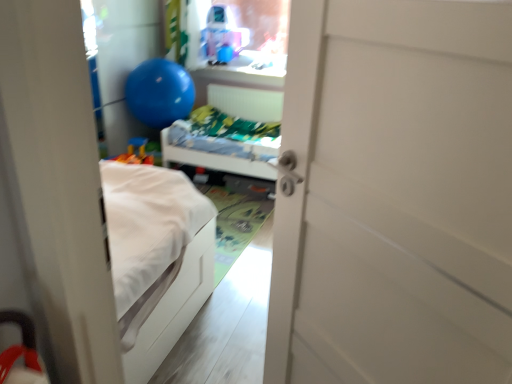
Question: Is blue rubber balloon at upper left positioned before translucent plastic toy at upper center?

Choices:
 (A) no
 (B) yes

Answer: (B)

Question: Is blue rubber balloon at upper left positioned beyond the bounds of translucent plastic toy at upper center?

Choices:
 (A) no
 (B) yes

Answer: (B)

Question: From the image's perspective, is blue rubber balloon at upper left located above translucent plastic toy at upper center?

Choices:
 (A) yes
 (B) no

Answer: (B)

Question: From a real-world perspective, does blue rubber balloon at upper left stand above translucent plastic toy at upper center?

Choices:
 (A) no
 (B) yes

Answer: (A)

Question: Is blue rubber balloon at upper left far from translucent plastic toy at upper center?

Choices:
 (A) no
 (B) yes

Answer: (A)

Question: Looking at the image, does white matte door at center seem bigger or smaller compared to white matte hospital bed at center?

Choices:
 (A) small
 (B) big

Answer: (A)

Question: In terms of height, does white matte door at center look taller or shorter compared to white matte hospital bed at center?

Choices:
 (A) tall
 (B) short

Answer: (A)

Question: From the image's perspective, is white matte door at center located above or below white matte hospital bed at center?

Choices:
 (A) above
 (B) below

Answer: (B)

Question: Is point (457, 79) positioned closer to the camera than point (208, 92)?

Choices:
 (A) farther
 (B) closer

Answer: (B)

Question: Is blue rubber balloon at upper left to the left or to the right of white matte hospital bed at center in the image?

Choices:
 (A) left
 (B) right

Answer: (A)

Question: Is blue rubber balloon at upper left bigger or smaller than white matte hospital bed at center?

Choices:
 (A) small
 (B) big

Answer: (A)

Question: Is blue rubber balloon at upper left in front of or behind white matte hospital bed at center in the image?

Choices:
 (A) behind
 (B) front

Answer: (A)

Question: Is point (177, 94) closer or farther from the camera than point (203, 162)?

Choices:
 (A) closer
 (B) farther

Answer: (B)

Question: In terms of width, does white matte door at center look wider or thinner when compared to blue rubber balloon at upper left?

Choices:
 (A) wide
 (B) thin

Answer: (B)

Question: Is white matte door at center in front of or behind blue rubber balloon at upper left in the image?

Choices:
 (A) front
 (B) behind

Answer: (A)